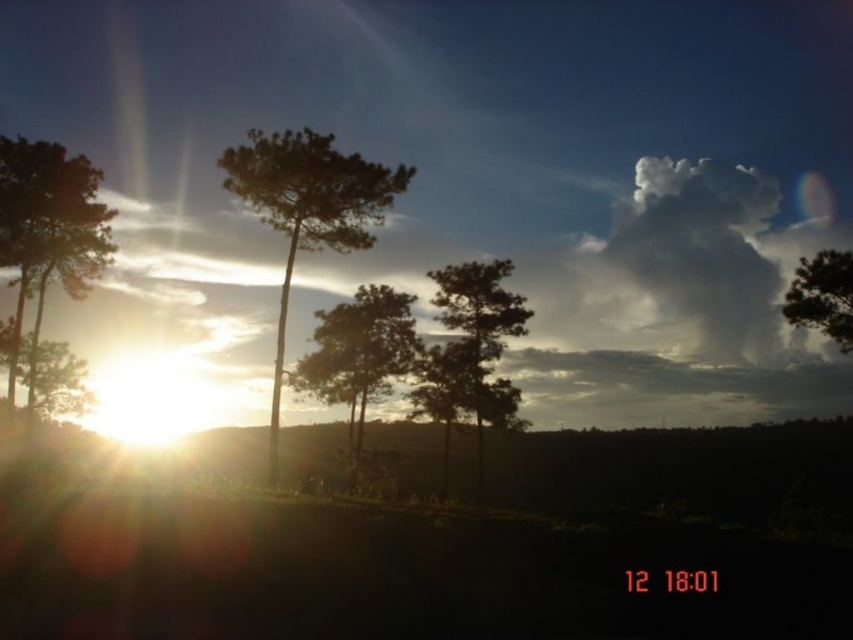
Looking at this image, you are standing in the sunset scene and want to take a photo. There are two points marked in the image. The first point is at coordinates point (363, 416) and the second is at point (807, 296). Which point is closer to your camera?

Point (363, 416) is further to the camera than point (807, 296), so the second point is closer to the camera.

You are an artist painting this sunset scene. You want to ensure the green matte tree at center and the green matte tree at upper right are proportionally accurate. Which tree should you draw wider in your painting?

The green matte tree at center should be drawn wider because its width is larger than the green matte tree at upper right.